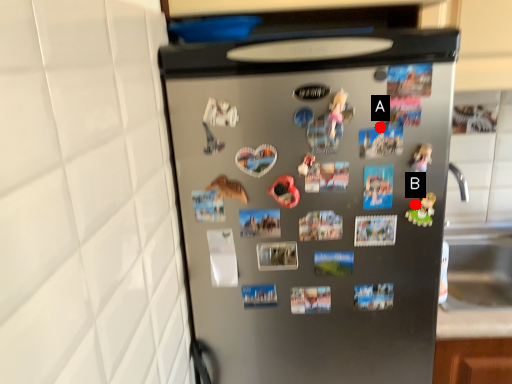
Question: Two points are circled on the image, labeled by A and B beside each circle. Which point appears closest to the camera in this image?

Choices:
 (A) A is closer
 (B) B is closer

Answer: (A)